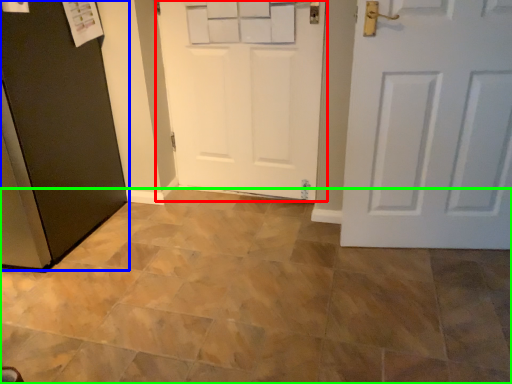
Question: Which object is the closest to the door (highlighted by a red box)? Choose among these: door (highlighted by a blue box) or ceramic tile (highlighted by a green box).

Choices:
 (A) door
 (B) ceramic tile

Answer: (A)